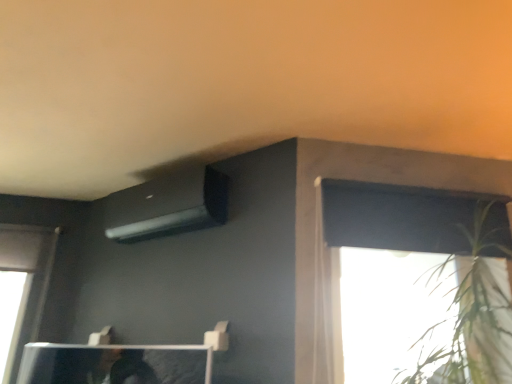
Question: Are black matte air conditioner at upper center and white sheer curtain at upper right located far from each other?

Choices:
 (A) no
 (B) yes

Answer: (A)

Question: Considering the relative sizes of black matte air conditioner at upper center and white sheer curtain at upper right in the image provided, is black matte air conditioner at upper center shorter than white sheer curtain at upper right?

Choices:
 (A) no
 (B) yes

Answer: (B)

Question: Does black matte air conditioner at upper center have a greater width compared to white sheer curtain at upper right?

Choices:
 (A) no
 (B) yes

Answer: (B)

Question: Is black matte air conditioner at upper center facing towards white sheer curtain at upper right?

Choices:
 (A) yes
 (B) no

Answer: (B)

Question: From a real-world perspective, is black matte air conditioner at upper center physically below white sheer curtain at upper right?

Choices:
 (A) no
 (B) yes

Answer: (A)

Question: Is black matte air conditioner at upper center outside of white sheer curtain at upper right?

Choices:
 (A) yes
 (B) no

Answer: (A)

Question: Can you confirm if black matte air conditioner at upper center is thinner than green leafy plant at upper right?

Choices:
 (A) no
 (B) yes

Answer: (B)

Question: Would you say black matte air conditioner at upper center is a long distance from green leafy plant at upper right?

Choices:
 (A) no
 (B) yes

Answer: (B)

Question: Is black matte air conditioner at upper center positioned in front of green leafy plant at upper right?

Choices:
 (A) yes
 (B) no

Answer: (B)

Question: Can you confirm if black matte air conditioner at upper center is bigger than green leafy plant at upper right?

Choices:
 (A) yes
 (B) no

Answer: (B)

Question: From the image's perspective, would you say black matte air conditioner at upper center is positioned over green leafy plant at upper right?

Choices:
 (A) no
 (B) yes

Answer: (B)

Question: Is black matte air conditioner at upper center taller than green leafy plant at upper right?

Choices:
 (A) yes
 (B) no

Answer: (B)

Question: Considering the relative sizes of green leafy plant at upper right and black matte air conditioner at upper center in the image provided, is green leafy plant at upper right bigger than black matte air conditioner at upper center?

Choices:
 (A) no
 (B) yes

Answer: (B)